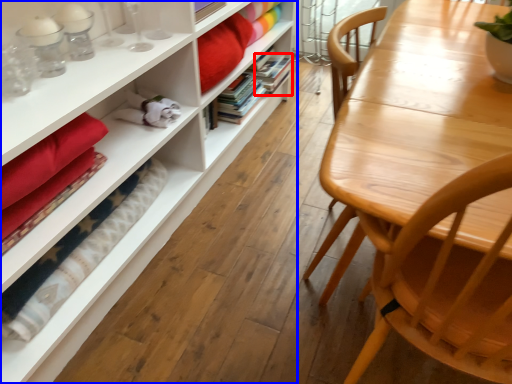
Question: Which object is further to the camera taking this photo, book (highlighted by a red box) or bookcase (highlighted by a blue box)?

Choices:
 (A) book
 (B) bookcase

Answer: (A)